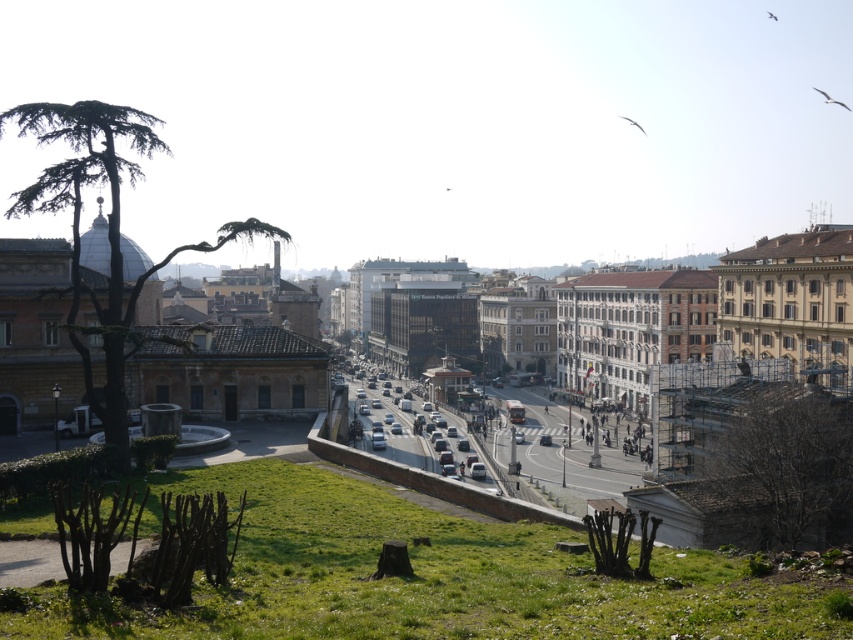
Between green leafy palm tree at left and silver metallic car at center, which one has less height?

silver metallic car at center

What do you see at coordinates (106, 225) in the screenshot? I see `green leafy palm tree at left` at bounding box center [106, 225].

I want to click on green leafy palm tree at left, so click(x=106, y=225).

The width and height of the screenshot is (853, 640). In order to click on green leafy palm tree at left in this screenshot , I will do `click(106, 225)`.